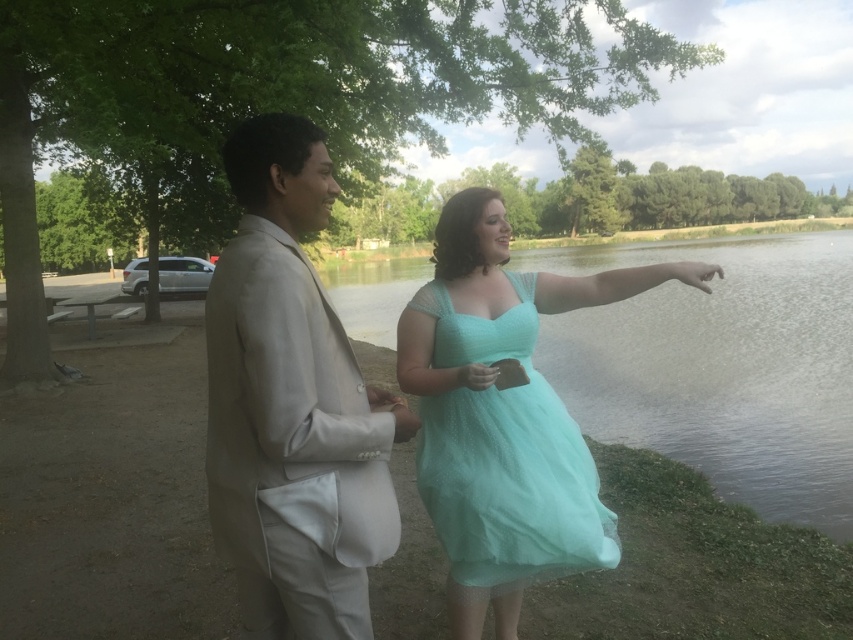
Question: Which of the following is the closest to the observer?

Choices:
 (A) (517, 477)
 (B) (506, 502)

Answer: (B)

Question: Is satin beige suit at left closer to the viewer compared to tulle dress at center?

Choices:
 (A) yes
 (B) no

Answer: (A)

Question: Is satin beige suit at left closer to the viewer compared to mint tulle dress at center?

Choices:
 (A) yes
 (B) no

Answer: (A)

Question: From the image, what is the correct spatial relationship of mint green fabric dress at right in relation to mint tulle dress at center?

Choices:
 (A) below
 (B) above

Answer: (B)

Question: Which point is closer to the camera?

Choices:
 (A) (444, 515)
 (B) (370, 397)
 (C) (587, 524)

Answer: (B)

Question: Estimate the real-world distances between objects in this image. Which object is closer to the satin beige suit at left?

Choices:
 (A) tulle dress at center
 (B) mint green fabric dress at right

Answer: (A)